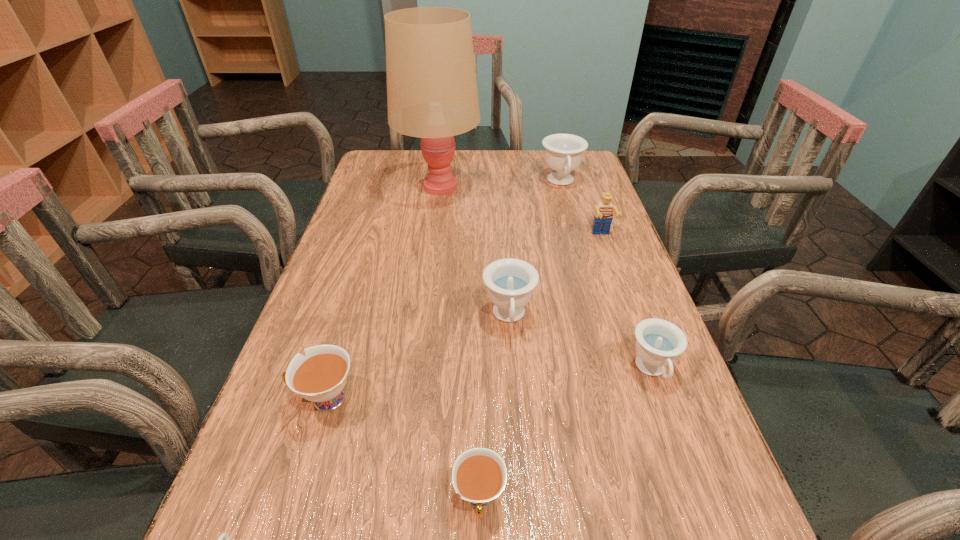
Where is `pink lampshade`? The height and width of the screenshot is (540, 960). pink lampshade is located at coordinates (432, 94).

At what (x,y) coordinates should I click in order to perform the action: click on lampshade. Please return your answer as a coordinate pair (x, y). This screenshot has width=960, height=540. Looking at the image, I should click on (432, 94).

The height and width of the screenshot is (540, 960). In order to click on the farthest teacup in this screenshot , I will do `click(563, 152)`.

At what (x,y) coordinates should I click in order to perform the action: click on the biggest blue teacup. Please return your answer as a coordinate pair (x, y). The image size is (960, 540). Looking at the image, I should click on (563, 152).

Identify the location of the third farthest object. (603, 216).

This screenshot has width=960, height=540. In order to click on blue Lego in this screenshot , I will do `click(603, 216)`.

You are a GUI agent. You are given a task and a screenshot of the screen. Output one action in this format:
    pyautogui.click(x=<x>, y=<y>)
    Task: Click on the fourth farthest object
    
    Given the screenshot: What is the action you would take?
    pyautogui.click(x=510, y=282)

Locate an element on the screen. The width and height of the screenshot is (960, 540). the third nearest blue teacup is located at coordinates (510, 282).

Locate an element on the screen. This screenshot has height=540, width=960. the left white teacup is located at coordinates (320, 377).

The height and width of the screenshot is (540, 960). In order to click on the bigger white teacup in this screenshot , I will do `click(320, 377)`.